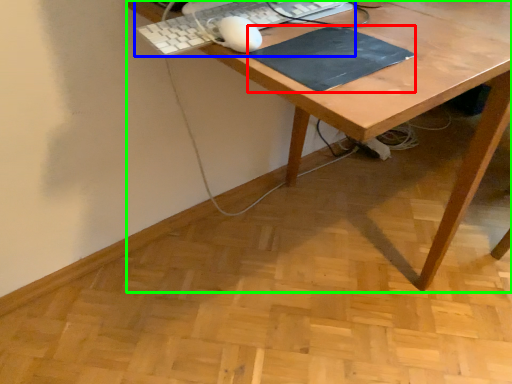
Question: Based on their relative distances, which object is farther from mousepad (highlighted by a red box)? Choose from computer keyboard (highlighted by a blue box) and desk (highlighted by a green box).

Choices:
 (A) computer keyboard
 (B) desk

Answer: (A)